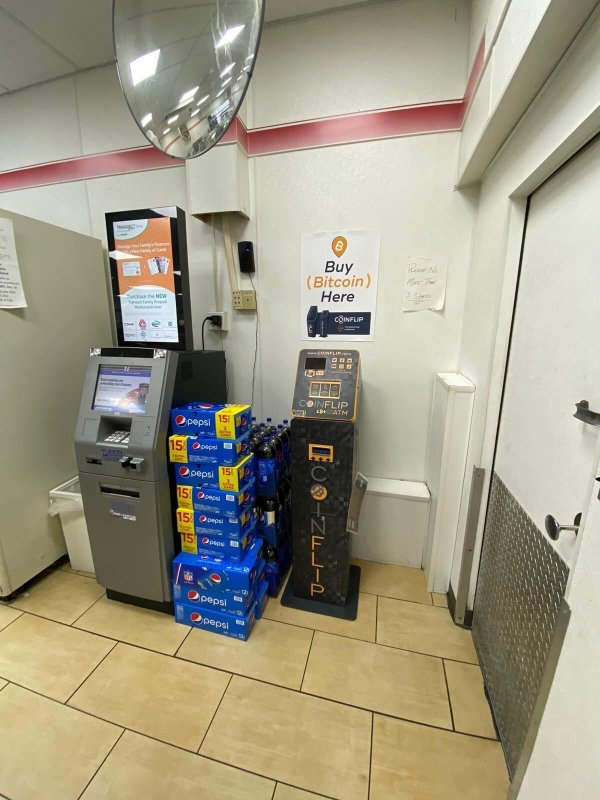
The width and height of the screenshot is (600, 800). Identify the location of power outlet. (215, 317).